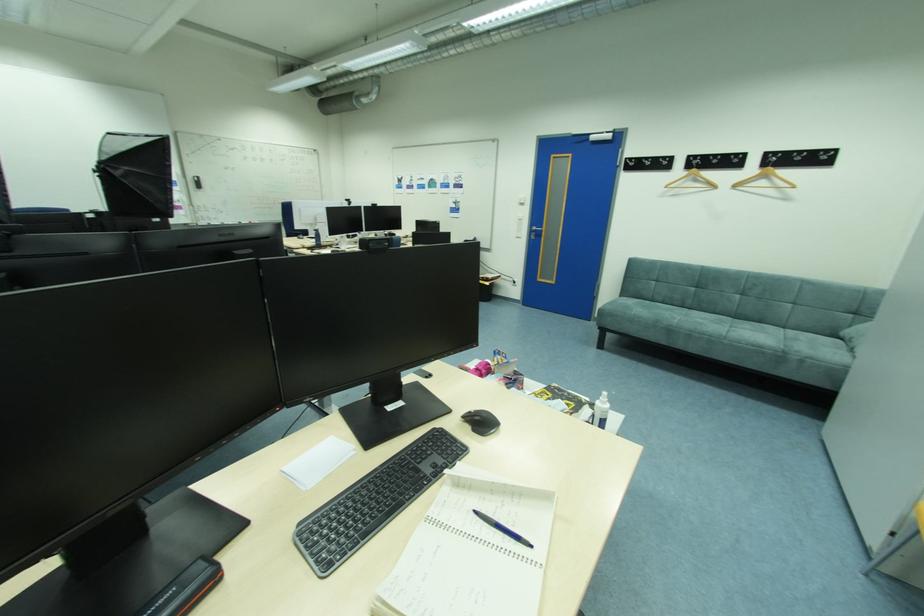
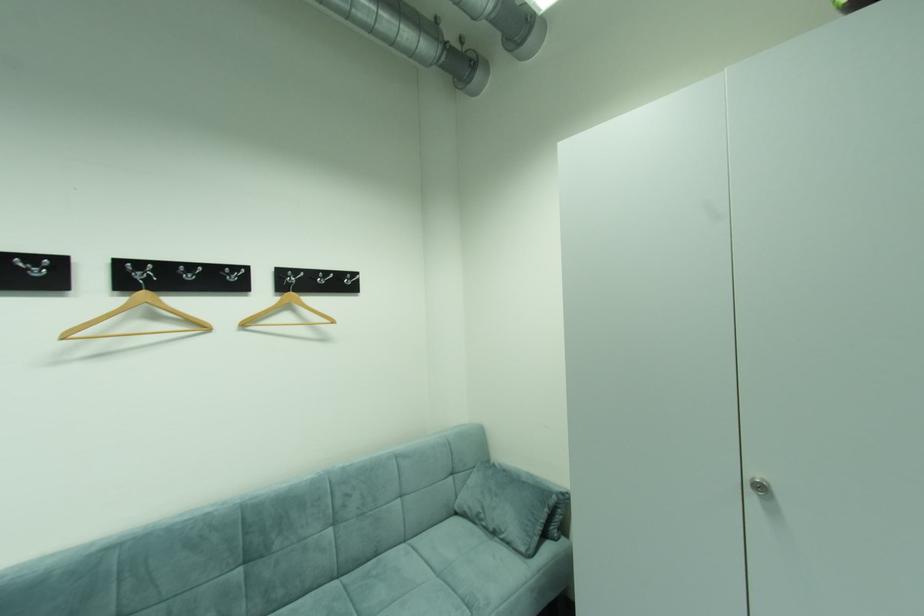
In the second image, find the point that corresponds to point 700,171 in the first image.

(150, 294)